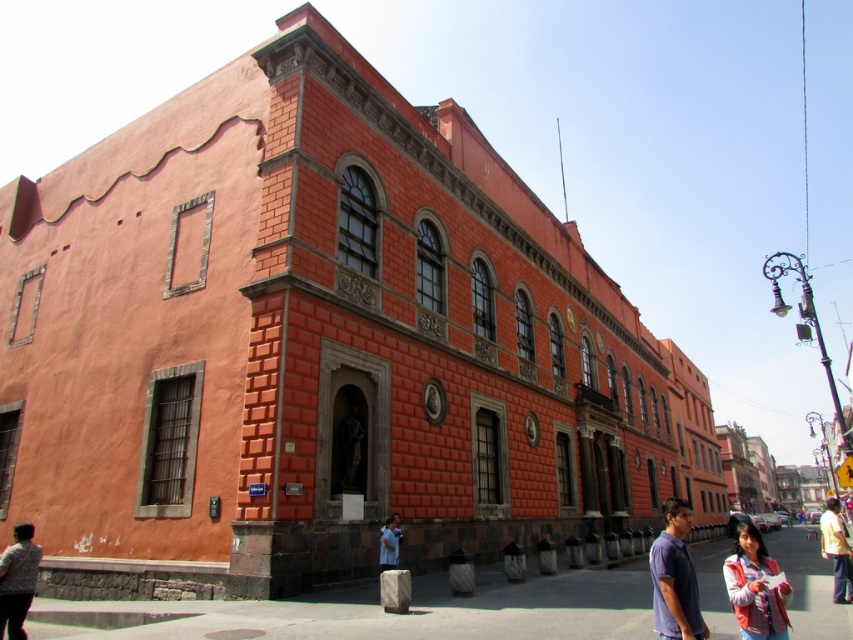
Question: Which point is closer to the camera?

Choices:
 (A) (683, 545)
 (B) (389, 544)
 (C) (738, 589)

Answer: (C)

Question: Can you confirm if purple cotton shirt at lower right is wider than vivid pink jacket at lower right?

Choices:
 (A) no
 (B) yes

Answer: (A)

Question: Which of the following is the farthest from the observer?

Choices:
 (A) floral fabric blouse at lower left
 (B) vivid pink jacket at lower right
 (C) yellow cotton shirt at lower right

Answer: (C)

Question: Among these points, which one is nearest to the camera?

Choices:
 (A) (688, 621)
 (B) (36, 570)

Answer: (A)

Question: Is purple cotton shirt at lower right smaller than vivid pink jacket at lower right?

Choices:
 (A) yes
 (B) no

Answer: (A)

Question: Is purple cotton shirt at lower right above floral fabric blouse at lower left?

Choices:
 (A) yes
 (B) no

Answer: (B)